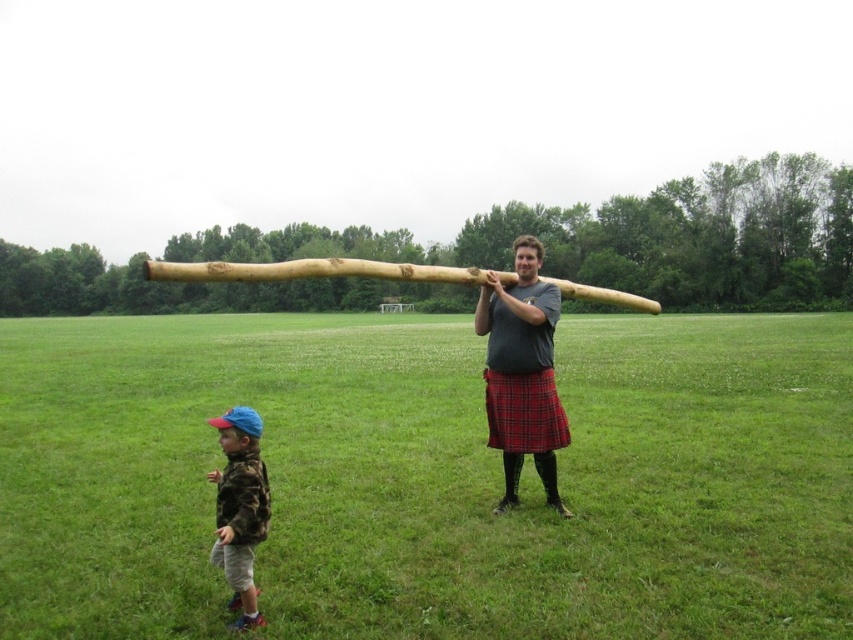
You are a photographer trying to capture the entire scene in one shot. Given that the green grass at center and the matte wooden pole at center are both in the frame, which object would appear larger in your photo?

Result: The green grass at center would appear larger in the photo since it is bigger than the matte wooden pole at center according to the description.

You are a photographer trying to capture a photo of the matte wooden pole at center and the camo fabric shirt at lower left. Which object should you focus on first if you want to ensure both are in sharp focus?

The matte wooden pole at center is much taller than the camo fabric shirt at lower left, so focusing on the matte wooden pole at center first would ensure both are in sharp focus since it is larger and more prominent.

Looking at this image, you are standing in the grassy field and see the adult with the red plaid kilt on the right and the child in the camouflage jacket on the left. There is a point marked at coordinates (x=521, y=372). What object does this point indicate?

The point at (x=521, y=372) indicates the matte wooden pole at center.